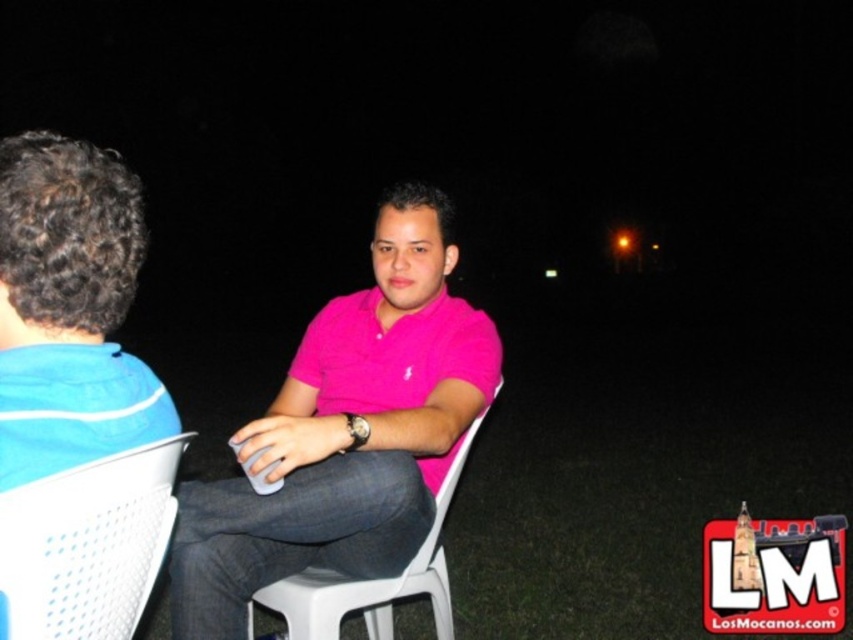
Is blue cotton shirt at left bigger than white plastic chair at lower left?

Indeed, blue cotton shirt at left has a larger size compared to white plastic chair at lower left.

Is blue cotton shirt at left taller than white plastic chair at lower left?

Yes.

Measure the distance between blue cotton shirt at left and camera.

36.97 inches

I want to click on blue cotton shirt at left, so click(x=68, y=308).

Measure the distance from pink matte shirt at center to white plastic chair at lower left.

15.95 inches

Consider the image. Can you confirm if pink matte shirt at center is positioned below white plastic chair at lower left?

Incorrect, pink matte shirt at center is not positioned below white plastic chair at lower left.

Between point (267, 538) and point (86, 472), which one is positioned behind?

Point (267, 538)

Identify the location of pink matte shirt at center. This screenshot has width=853, height=640. (345, 433).

Is the position of pink matte shirt at center less distant than that of white plastic chair at center?

Yes, pink matte shirt at center is closer to the viewer.

Who is shorter, pink matte shirt at center or white plastic chair at center?

white plastic chair at center

Who is more forward, (x=280, y=564) or (x=277, y=582)?

Point (x=280, y=564) is in front.

Locate an element on the screen. The height and width of the screenshot is (640, 853). pink matte shirt at center is located at coordinates (345, 433).